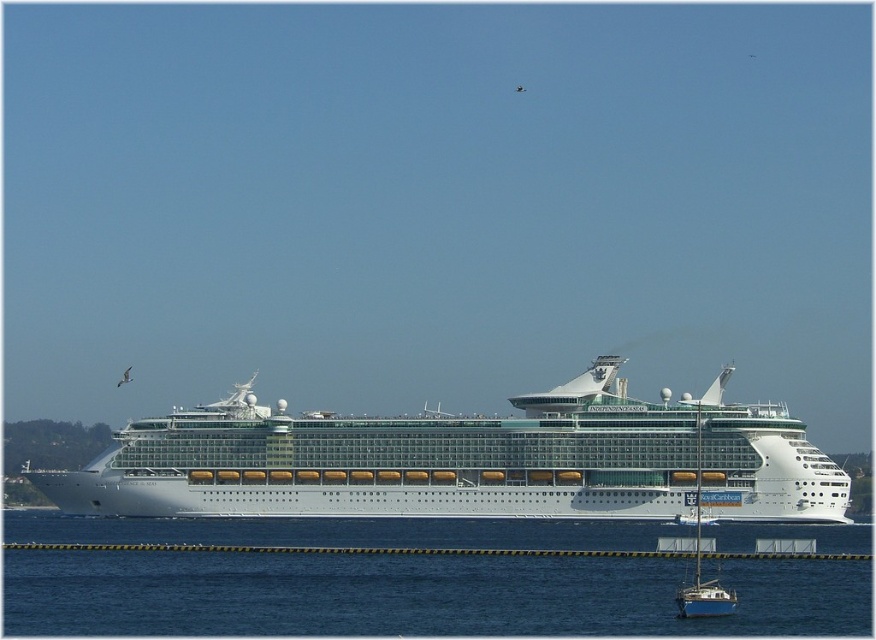
Question: Which of the following is the farthest from the observer?

Choices:
 (A) (546, 481)
 (B) (118, 554)

Answer: (A)

Question: Is blue water at lower center further to camera compared to white glossy cruise ship at center?

Choices:
 (A) yes
 (B) no

Answer: (B)

Question: Can you confirm if blue water at lower center is smaller than white glossy cruise ship at center?

Choices:
 (A) yes
 (B) no

Answer: (A)

Question: Is blue water at lower center to the right of white glossy cruise ship at center from the viewer's perspective?

Choices:
 (A) no
 (B) yes

Answer: (A)

Question: Which of the following is the farthest from the observer?

Choices:
 (A) 364,593
 (B) 146,428

Answer: (B)